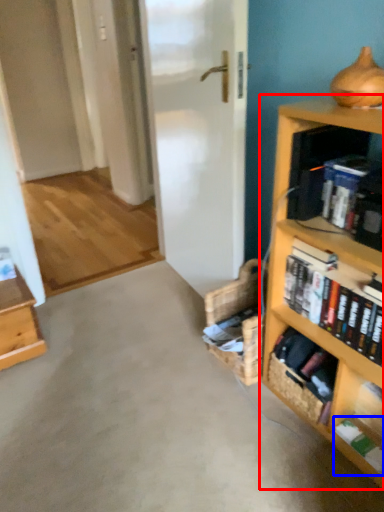
Question: Among these objects, which one is farthest to the camera, bookcase (highlighted by a red box) or book (highlighted by a blue box)?

Choices:
 (A) bookcase
 (B) book

Answer: (B)